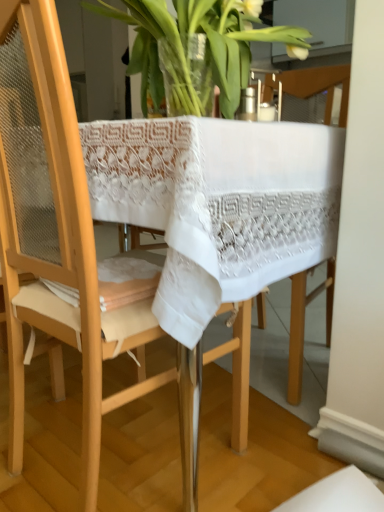
The width and height of the screenshot is (384, 512). Find the location of `free spot to the right of wooden chair at center`. free spot to the right of wooden chair at center is located at coordinates tap(253, 440).